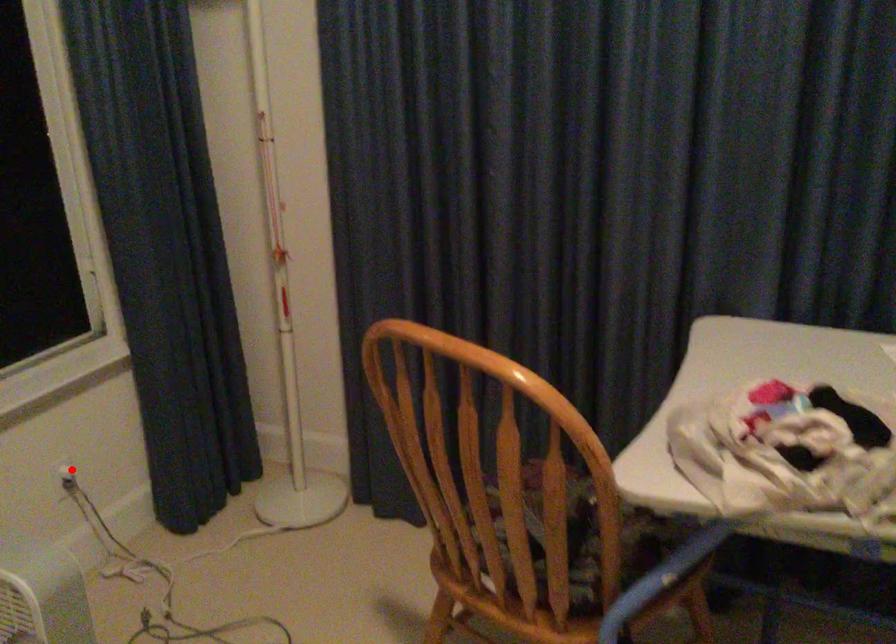
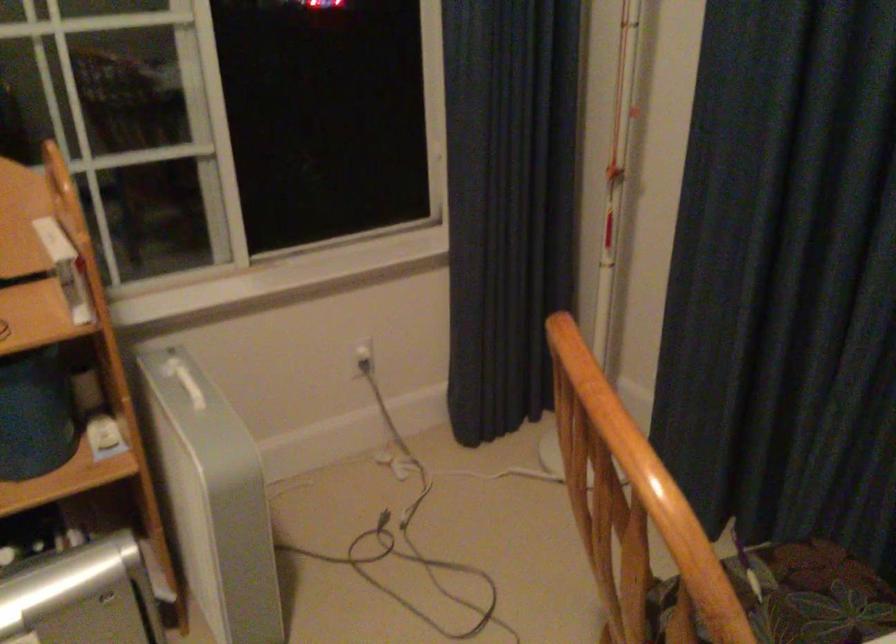
Where in the second image is the point corresponding to the highlighted location from the first image?

(363, 355)